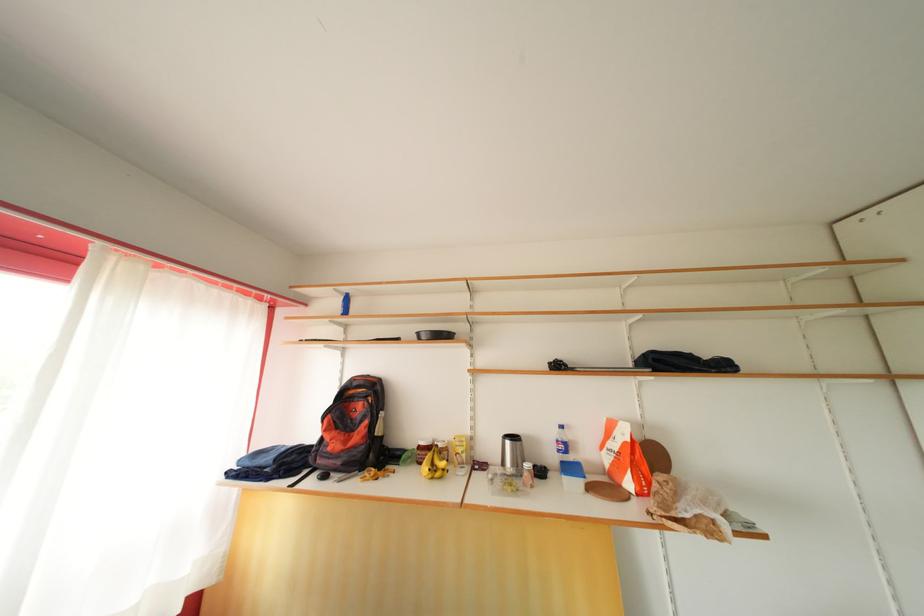
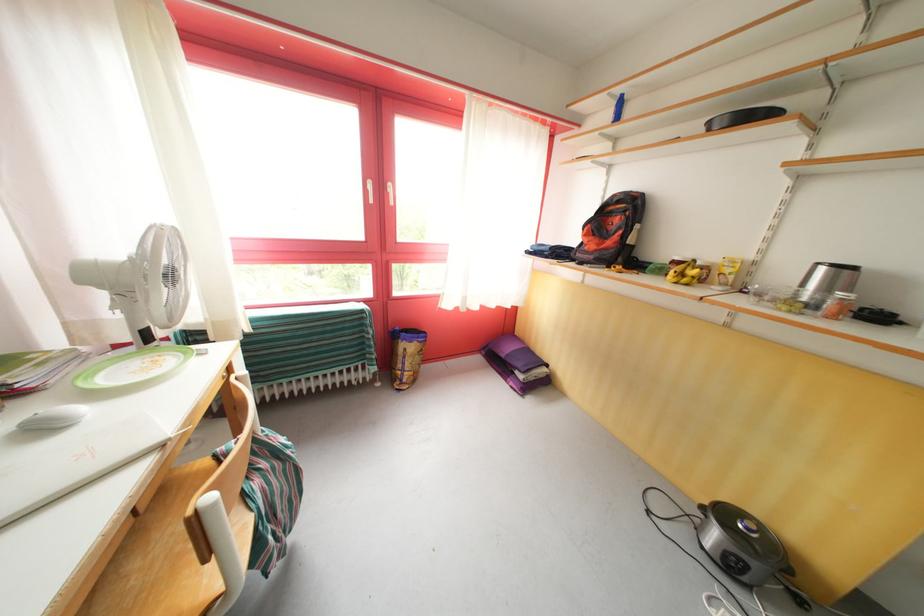
In the second image, find the point that corresponds to the point at 317,440 in the first image.

(580, 245)